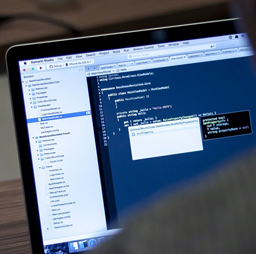
Identify the location of white wall. (10, 165).